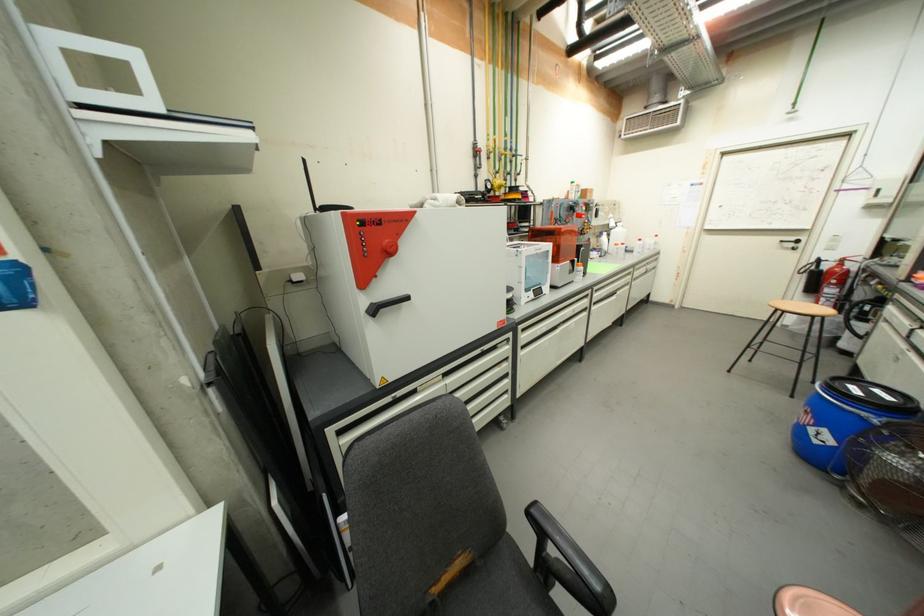
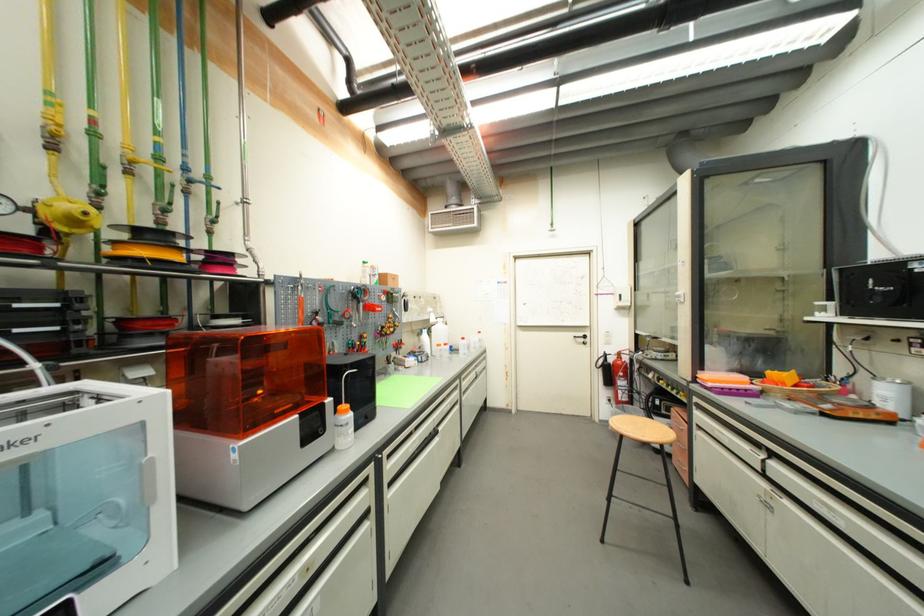
Find the pixel in the second image that matches the point at 509,174 in the first image.

(160, 207)